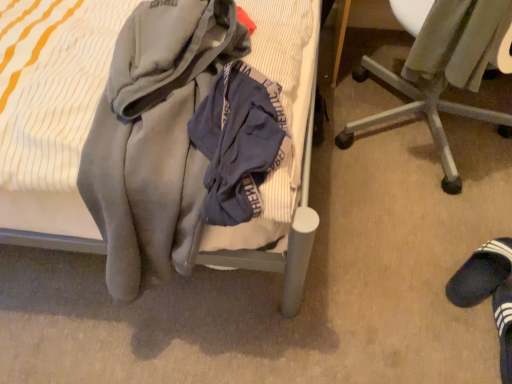
Question: From a real-world perspective, is black suede slipper at lower right physically located above or below soft gray blanket at center?

Choices:
 (A) below
 (B) above

Answer: (A)

Question: In terms of size, does black suede slipper at lower right appear bigger or smaller than soft gray blanket at center?

Choices:
 (A) small
 (B) big

Answer: (A)

Question: Which of these objects is positioned closest to the black suede slipper at lower right?

Choices:
 (A) metallic silver chair at lower right
 (B) velvet-like gray sweater at lower right
 (C) soft gray blanket at center

Answer: (A)

Question: Based on their relative distances, which object is farther from the metallic silver chair at lower right?

Choices:
 (A) black suede slipper at lower right
 (B) soft gray blanket at center
 (C) velvet-like gray sweater at lower right

Answer: (B)